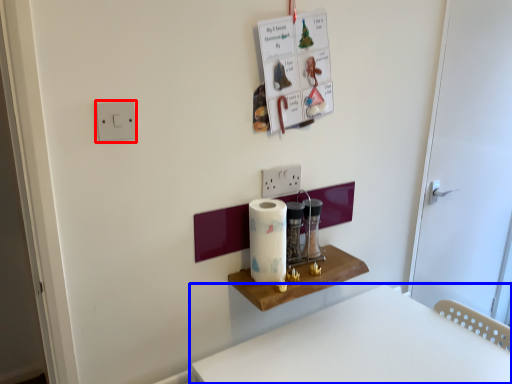
Question: Among these objects, which one is farthest to the camera, light switch (highlighted by a red box) or furniture (highlighted by a blue box)?

Choices:
 (A) light switch
 (B) furniture

Answer: (A)